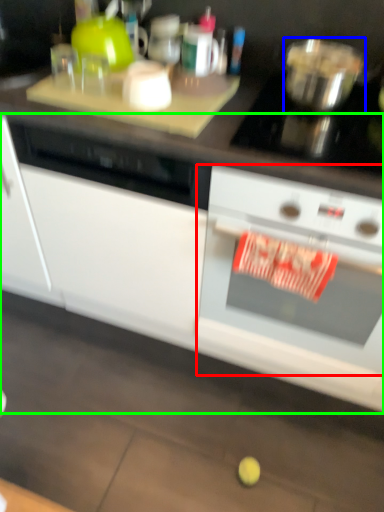
Question: Considering the real-world distances, which object is closest to kitchen appliance (highlighted by a red box)? bowl (highlighted by a blue box) or cabinetry (highlighted by a green box).

Choices:
 (A) bowl
 (B) cabinetry

Answer: (B)